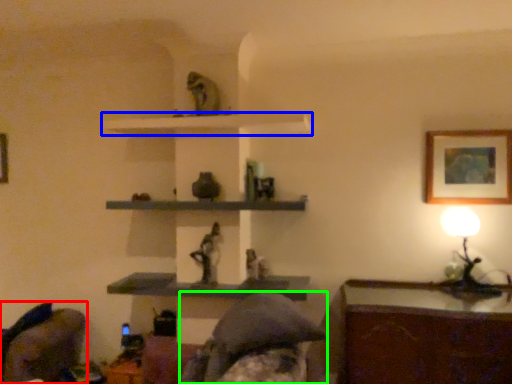
Question: Which object is positioned farthest from swivel chair (highlighted by a red box)? Select from shelf (highlighted by a blue box) and person (highlighted by a green box).

Choices:
 (A) shelf
 (B) person

Answer: (A)